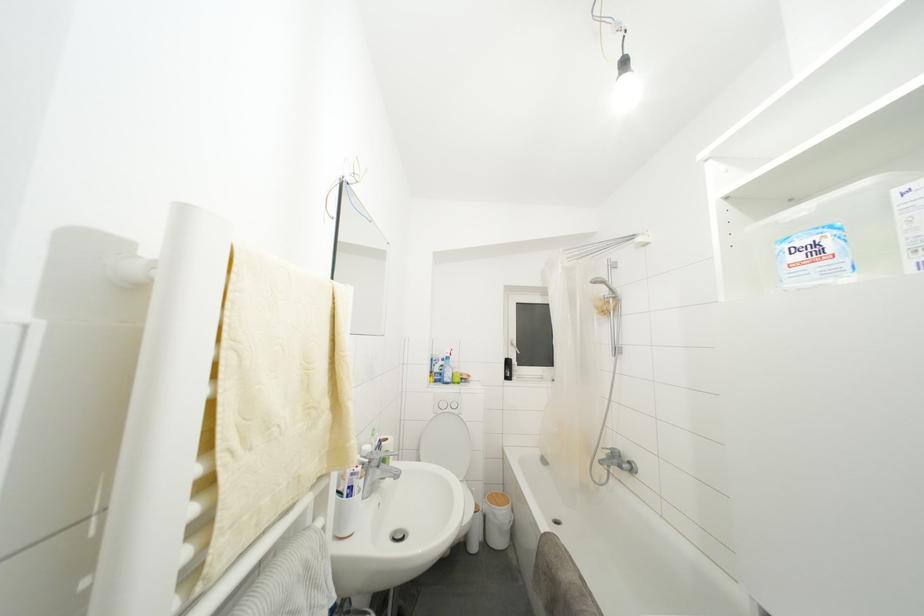
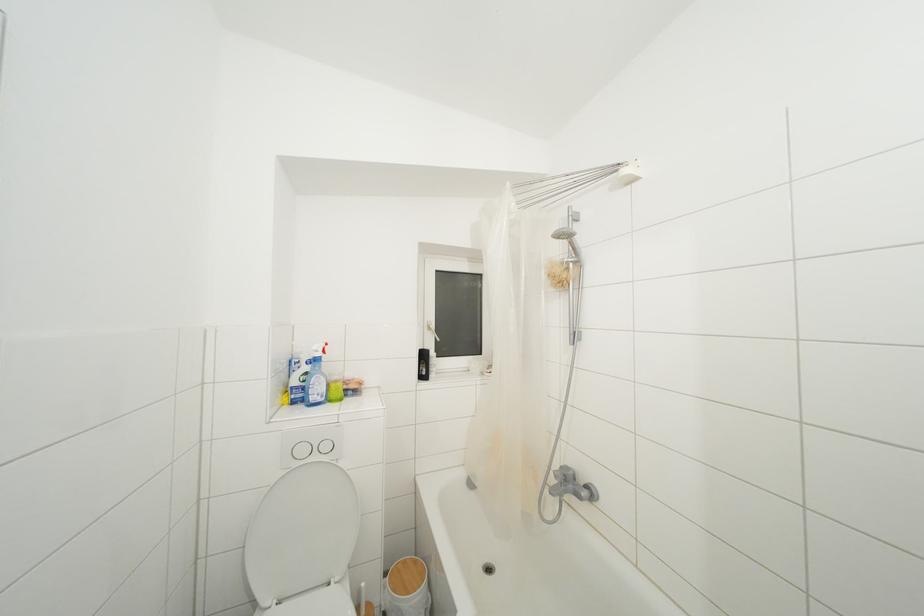
Where in the second image is the point corresponding to the point at 517,350 from the first image?

(433, 333)